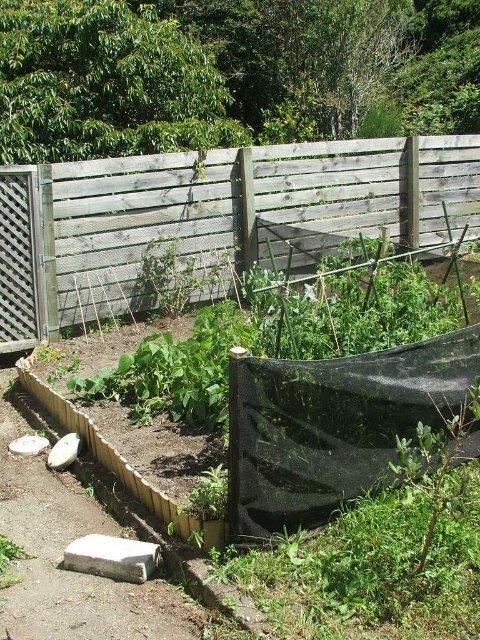
Between point (15, 237) and point (27, 474), which one is positioned behind?

Positioned behind is point (15, 237).

Does wooden fence at upper center appear under brown dirt path at lower left?

Actually, wooden fence at upper center is above brown dirt path at lower left.

Where is `wooden fence at upper center`? wooden fence at upper center is located at coordinates (214, 218).